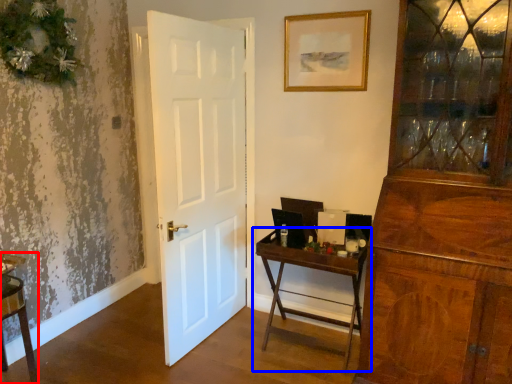
Question: Which point is further to the camera, vanity (highlighted by a red box) or table (highlighted by a blue box)?

Choices:
 (A) vanity
 (B) table

Answer: (B)